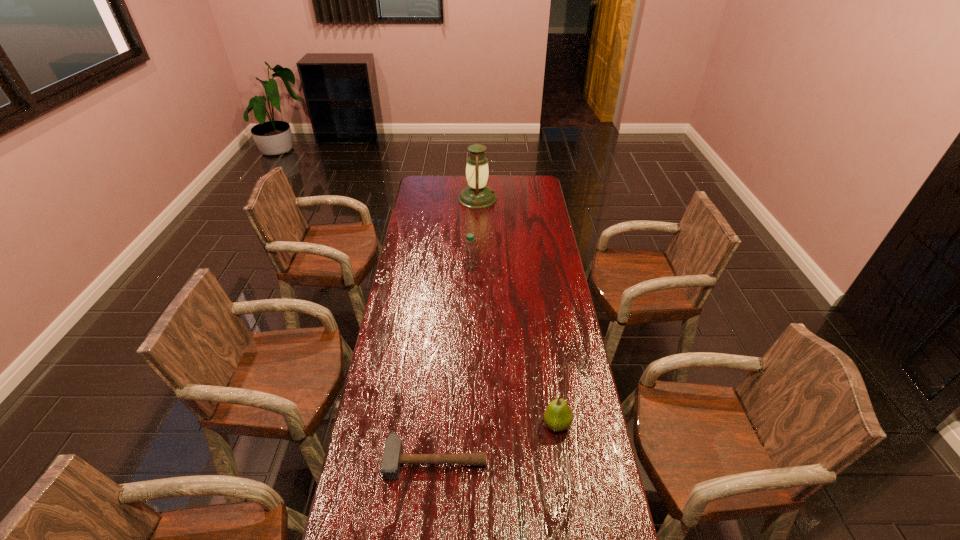
Locate an element on the screen. Image resolution: width=960 pixels, height=540 pixels. free space located 0.070m on the front of the pear is located at coordinates (562, 458).

Find the location of a particular element. The width and height of the screenshot is (960, 540). free space located on the striking surface of the hammer is located at coordinates (431, 517).

Where is `object present at the far edge`? This screenshot has height=540, width=960. object present at the far edge is located at coordinates (477, 195).

The image size is (960, 540). I want to click on object that is at the left edge, so click(x=393, y=457).

In order to click on object at the right edge in this screenshot , I will do `click(558, 416)`.

Where is `vacant space at the far edge`? The width and height of the screenshot is (960, 540). vacant space at the far edge is located at coordinates (515, 195).

I want to click on blank space at the left edge, so click(x=378, y=510).

In the image, there is a desktop. Where is `blank space at the right edge`? The width and height of the screenshot is (960, 540). blank space at the right edge is located at coordinates (537, 213).

In the image, there is a desktop. Identify the location of vacant space at the far left corner. Image resolution: width=960 pixels, height=540 pixels. (417, 184).

The height and width of the screenshot is (540, 960). Identify the location of blank region between the pear and the farthest object. (517, 311).